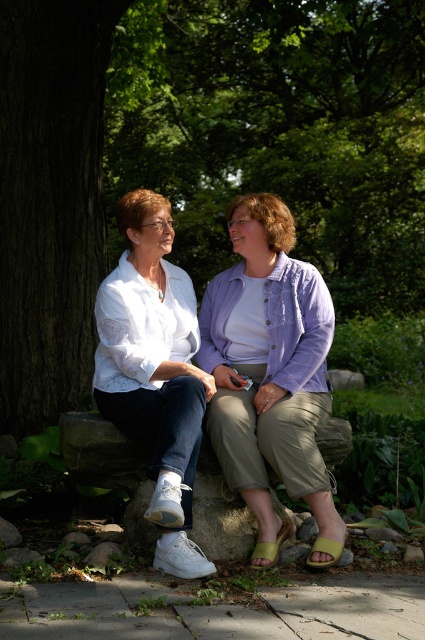
Where is `white cotton shirt at center`? white cotton shirt at center is located at coordinates (268, 374).

Can you confirm if white cotton shirt at center is wider than white matte shirt at left?

Indeed, white cotton shirt at center has a greater width compared to white matte shirt at left.

Identify the location of white cotton shirt at center. This screenshot has height=640, width=425. point(268,374).

Between brown textured tree trunk at left and white cotton shirt at center, which one has less height?

Standing shorter between the two is white cotton shirt at center.

Does brown textured tree trunk at left appear on the right side of white cotton shirt at center?

Yes, brown textured tree trunk at left is to the right of white cotton shirt at center.

Find the location of a particular element. The image size is (425, 640). brown textured tree trunk at left is located at coordinates (195, 156).

The image size is (425, 640). In order to click on brown textured tree trunk at left in this screenshot , I will do `click(195, 156)`.

Is brown textured tree trunk at left thinner than white matte shirt at left?

In fact, brown textured tree trunk at left might be wider than white matte shirt at left.

Does brown textured tree trunk at left appear over white matte shirt at left?

Yes.

Which is in front, point (388, 44) or point (170, 371)?

Point (170, 371)

Identify the location of brown textured tree trunk at left. (195, 156).